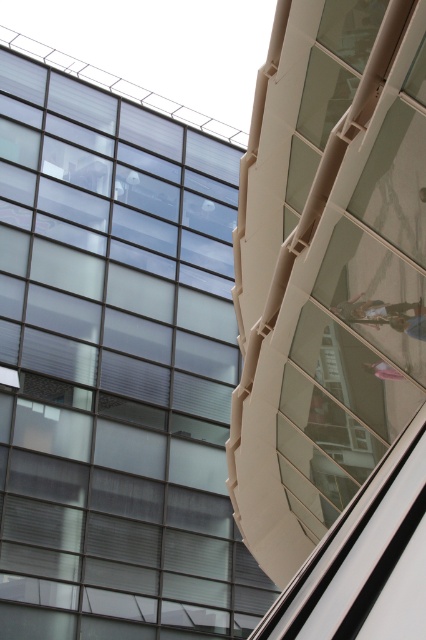
Is transparent glass window at upper left shorter than metallic silver person at center?

No.

Is point (86, 205) behind point (377, 300)?

Yes, point (86, 205) is behind point (377, 300).

Who is more distant from viewer, (192, 168) or (405, 324)?

Point (192, 168)

The height and width of the screenshot is (640, 426). Find the location of `transparent glass window at upper left`. transparent glass window at upper left is located at coordinates (115, 371).